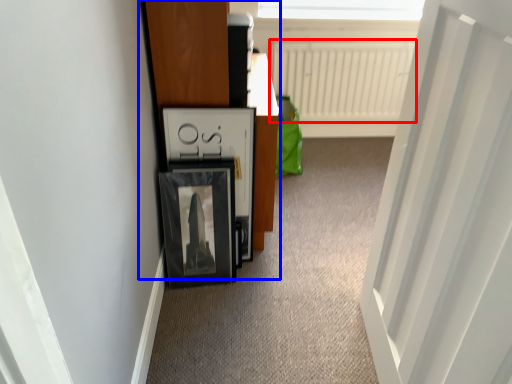
Question: Which of the following is the closest to the observer, radiator (highlighted by a red box) or dresser (highlighted by a blue box)?

Choices:
 (A) radiator
 (B) dresser

Answer: (B)